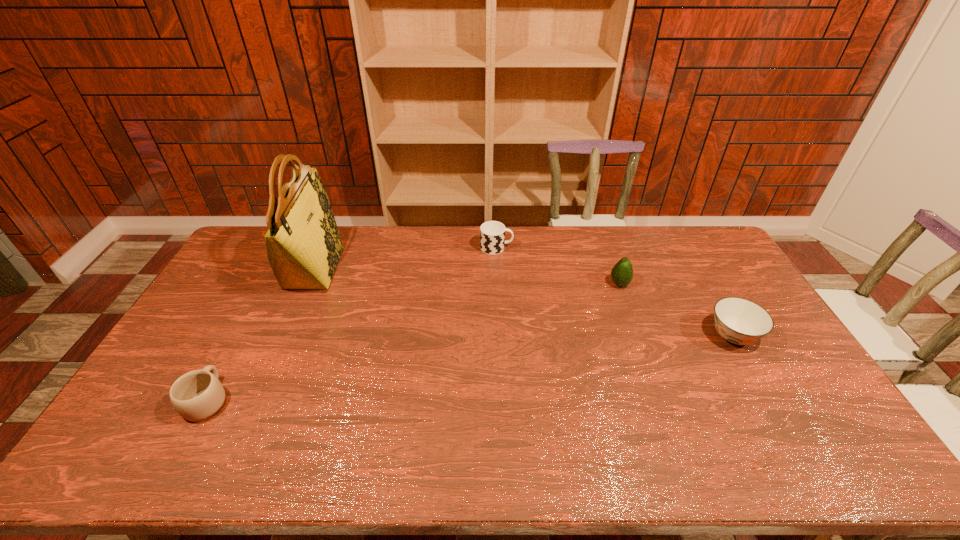
Find the location of a particular element. The height and width of the screenshot is (540, 960). free spot that satisfies the following two spatial constraints: 1. on the side of the cup with the handle; 2. on the left side of the fourth object from left to right is located at coordinates (498, 284).

The height and width of the screenshot is (540, 960). What are the coordinates of `vacant space that satisfies the following two spatial constraints: 1. on the side of the soup bowl with the handle; 2. on the left side of the nearest object` in the screenshot? It's located at (242, 336).

At what (x,y) coordinates should I click in order to perform the action: click on free spot that satisfies the following two spatial constraints: 1. on the side of the nearest object with the handle; 2. on the right side of the soup bowl. Please return your answer as a coordinate pair (x, y). The height and width of the screenshot is (540, 960). Looking at the image, I should click on [x=242, y=336].